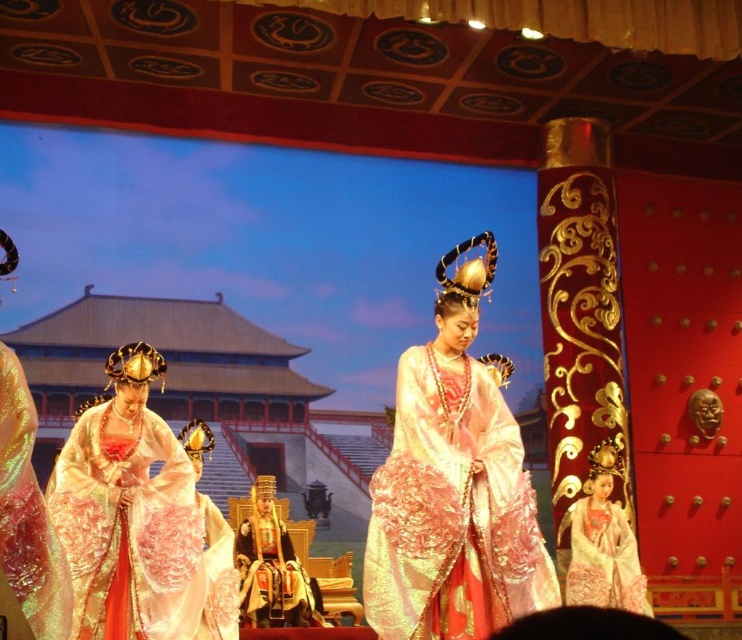
You are a stagehand preparing for a performance and need to ensure that the silky white gown at center and the silk embroidered robe at center are displayed properly. Since the stage has limited vertical space, which garment should be placed lower to avoid hitting the overhead lights?

The silk embroidered robe at center should be placed lower because it is shorter in height than the silky white gown at center, allowing the taller gown to be positioned higher without hitting the overhead lights.

You are a stagehand responsible for moving a 15 meter long red carpet from the entrance to the stage. The entrance is located where the iridescent silk dress at left is currently positioned. Can you place the carpet so that it reaches from the entrance to the silky pink gown at center without any overlap?

The distance between the silky pink gown at center and the iridescent silk dress at left is 16.39 meters. Since the red carpet is only 15 meters long, it cannot fully span the distance between the entrance at the iridescent silk dress at left and the silky pink gown at center without overlapping.

You are a stage designer preparing for a performance. You have two gowns to place on the stage. The silky pink gown at center and the iridescent silk dress at left. Considering their widths, which gown would require more horizontal space when displayed on the stage?

The silky pink gown at center requires more horizontal space because its width surpasses that of the iridescent silk dress at left.